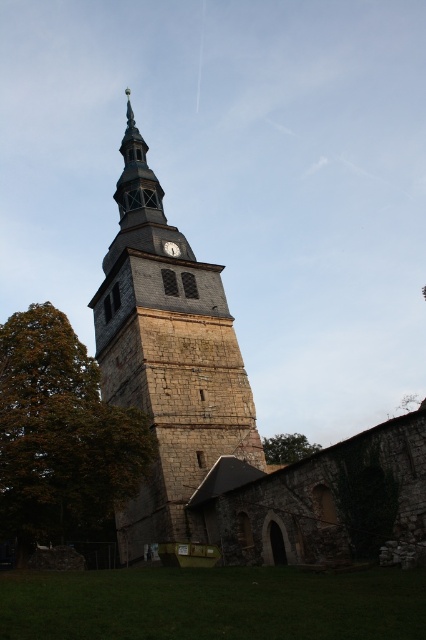
Is stone clock tower at center thinner than green leafy tree at left?

Incorrect, stone clock tower at center's width is not less than green leafy tree at left's.

Can you confirm if stone clock tower at center is positioned below green leafy tree at left?

No, stone clock tower at center is not below green leafy tree at left.

Does point (157, 388) lie in front of point (51, 317)?

No, (157, 388) is further to viewer.

I want to click on stone clock tower at center, so click(169, 360).

Looking at this image, who is more distant from viewer, [169,234] or [290,456]?

Positioned behind is point [290,456].

Measure the distance from stone clock tower at center to green leafy tree at center.

stone clock tower at center and green leafy tree at center are 24.66 meters apart.

At what (x,y) coordinates should I click in order to perform the action: click on stone clock tower at center. Please return your answer as a coordinate pair (x, y). The image size is (426, 640). Looking at the image, I should click on (169, 360).

Does point (69, 483) lie in front of point (273, 444)?

That is True.

Between green leafy tree at left and green leafy tree at center, which one is positioned higher?

green leafy tree at left is higher up.

Is point (46, 444) positioned before point (314, 451)?

Yes.

Identify the location of green leafy tree at left. Image resolution: width=426 pixels, height=640 pixels. (60, 435).